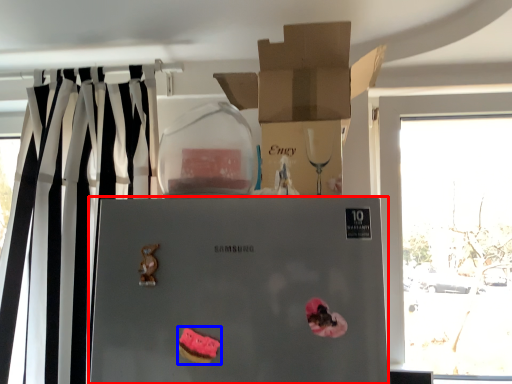
Question: Which object is closer to the camera taking this photo, refrigerator (highlighted by a red box) or stuff (highlighted by a blue box)?

Choices:
 (A) refrigerator
 (B) stuff

Answer: (A)